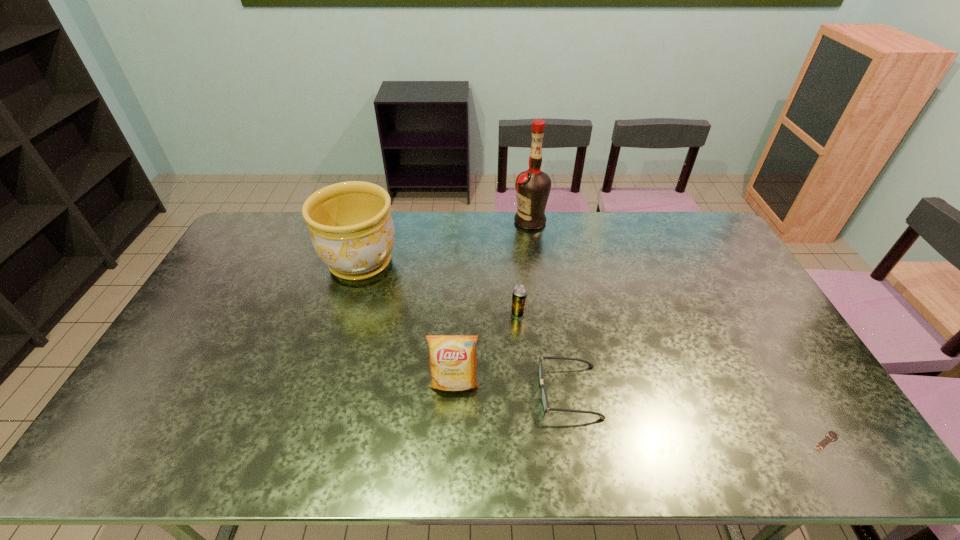
The height and width of the screenshot is (540, 960). I want to click on vacant space situated 0.270m on the left of the nearest object, so click(x=699, y=441).

Where is `liquor that is at the far edge`? This screenshot has width=960, height=540. liquor that is at the far edge is located at coordinates (533, 186).

The width and height of the screenshot is (960, 540). Find the location of `flowerpot that is positioned at the far edge`. flowerpot that is positioned at the far edge is located at coordinates (352, 231).

At what (x,y) coordinates should I click in order to perform the action: click on object that is at the near edge. Please return your answer as a coordinate pair (x, y). The height and width of the screenshot is (540, 960). Looking at the image, I should click on (831, 435).

Locate an element on the screen. Image resolution: width=960 pixels, height=540 pixels. object located at the right edge is located at coordinates (831, 435).

Identify the location of object that is at the near right corner. (831, 435).

The width and height of the screenshot is (960, 540). Identify the location of vacant space at the far edge of the desktop. (593, 245).

This screenshot has width=960, height=540. In the image, there is a desktop. Find the location of `vacant region at the near edge`. vacant region at the near edge is located at coordinates (234, 455).

I want to click on vacant space at the left edge of the desktop, so click(x=152, y=417).

Locate an element on the screen. vacant region at the right edge is located at coordinates (731, 272).